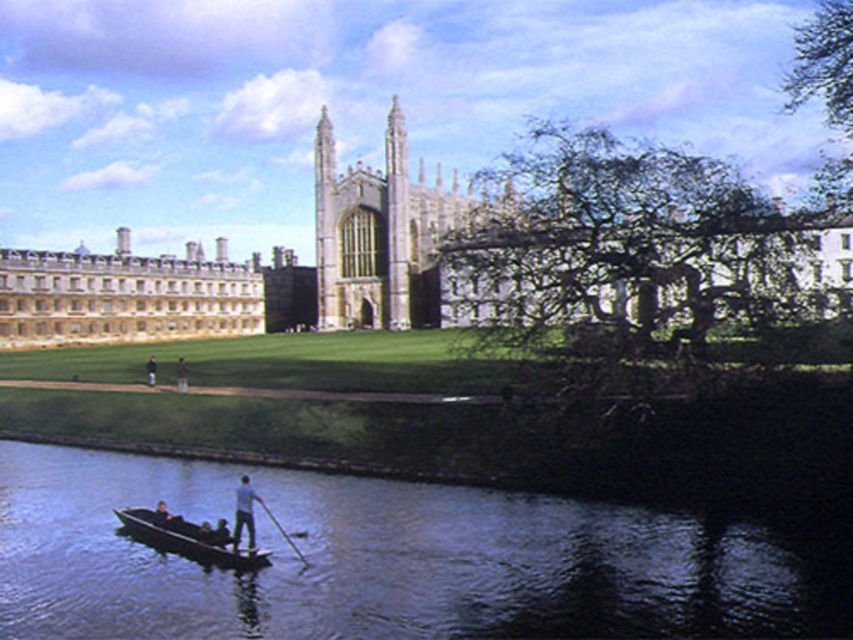
Is white cotton shirt at lower center bigger than wooden smooth paddle at lower center?

Yes.

This screenshot has height=640, width=853. Identify the location of white cotton shirt at lower center. (242, 513).

What are the coordinates of `white cotton shirt at lower center` in the screenshot? It's located at click(242, 513).

Does point (409, 323) come in front of point (254, 499)?

No, it is not.

Is stone gothic cathedral at center above wooden smooth paddle at lower center?

Indeed, stone gothic cathedral at center is positioned over wooden smooth paddle at lower center.

Which is in front, point (123, 256) or point (260, 504)?

Point (260, 504) is in front.

At what (x,y) coordinates should I click in order to perform the action: click on stone gothic cathedral at center. Please return your answer as a coordinate pair (x, y). Looking at the image, I should click on (381, 244).

Is wooden smooth paddle at lower center wider than light brown wooden paddle at center?

No.

What do you see at coordinates (281, 529) in the screenshot?
I see `wooden smooth paddle at lower center` at bounding box center [281, 529].

Is point (283, 538) positioned after point (184, 388)?

No, it is not.

This screenshot has height=640, width=853. In order to click on wooden smooth paddle at lower center in this screenshot , I will do `click(281, 529)`.